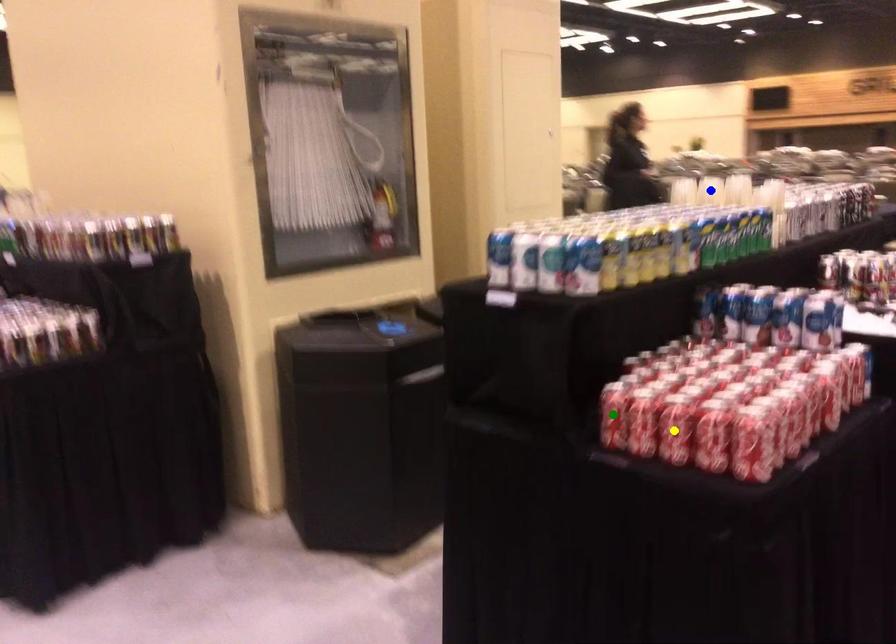
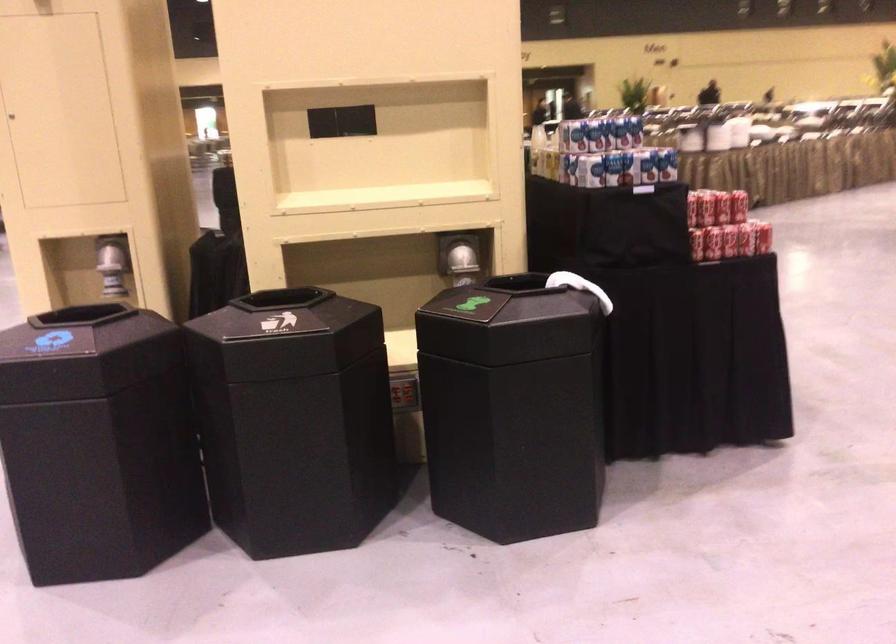
I am providing you with two images of the same scene from different viewpoints. Three points are marked in image1. Which point corresponds to a part or object that is occluded in image2?In image1, three points are marked. Which of them correspond to a part or object that is occluded in image2?Among the three points shown in image1, which one corresponds to a part or object that is no longer visible due to occlusion in image2?

Invisible in image2: blue point, yellow point, green point.